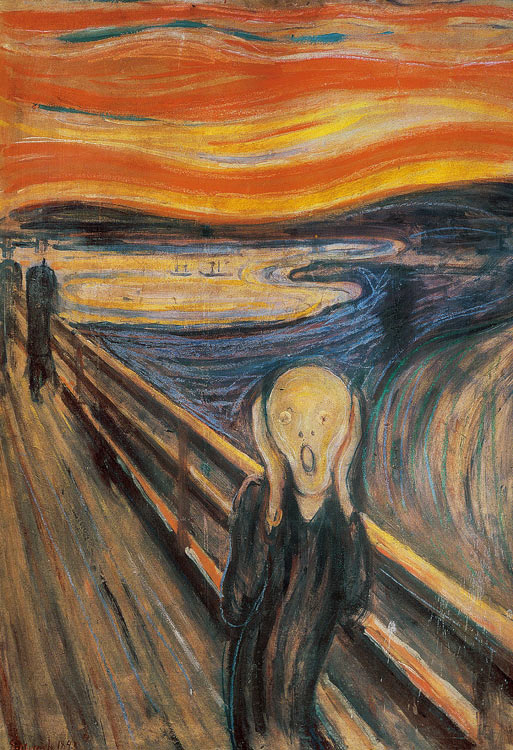
Identify the location of top of railing. Image resolution: width=513 pixels, height=750 pixels. click(215, 444).